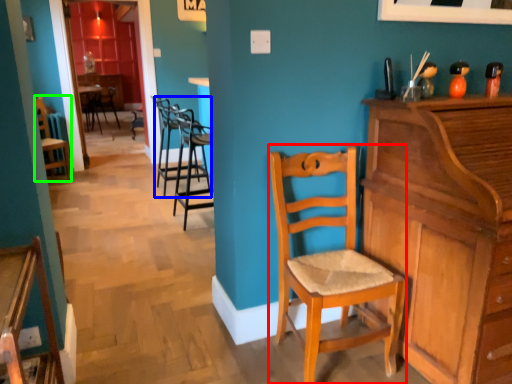
Question: Estimate the real-world distances between objects in this image. Which object is farther from chair (highlighted by a red box), chair (highlighted by a blue box) or chair (highlighted by a green box)?

Choices:
 (A) chair
 (B) chair

Answer: (B)